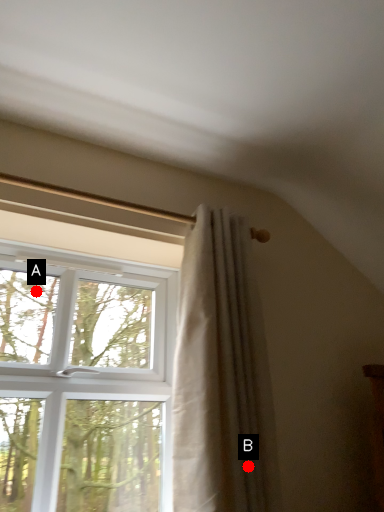
Question: Two points are circled on the image, labeled by A and B beside each circle. Among these points, which one is farthest from the camera?

Choices:
 (A) A is further
 (B) B is further

Answer: (A)